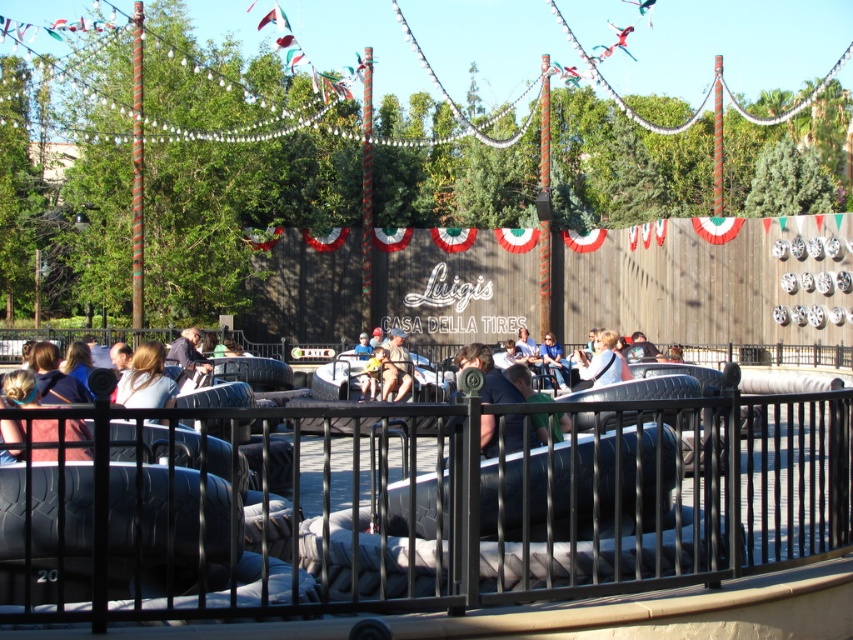
Between point (71, 476) and point (160, 380), which one is positioned in front?

Positioned in front is point (71, 476).

Does black metal fence at center appear under blonde hair at center?

Indeed, black metal fence at center is positioned under blonde hair at center.

This screenshot has width=853, height=640. What do you see at coordinates (425, 509) in the screenshot?
I see `black metal fence at center` at bounding box center [425, 509].

You are a GUI agent. You are given a task and a screenshot of the screen. Output one action in this format:
    pyautogui.click(x=<x>, y=<y>)
    Task: Click on the black metal fence at center
    
    Given the screenshot: What is the action you would take?
    pyautogui.click(x=425, y=509)

Is light blue shirt at center to the right of light blue denim jeans at center from the viewer's perspective?

Correct, you'll find light blue shirt at center to the right of light blue denim jeans at center.

Consider the image. Which is above, light blue shirt at center or light blue denim jeans at center?

Positioned higher is light blue shirt at center.

Is point (584, 374) closer to camera compared to point (543, 355)?

Yes, point (584, 374) is in front of point (543, 355).

The width and height of the screenshot is (853, 640). I want to click on light blue shirt at center, so click(602, 362).

Looking at this image, who is positioned more to the right, black metal fence at center or light blue shirt at center?

Positioned to the right is light blue shirt at center.

Does black metal fence at center have a lesser height compared to light blue shirt at center?

No, black metal fence at center is not shorter than light blue shirt at center.

The image size is (853, 640). What do you see at coordinates (425, 509) in the screenshot? I see `black metal fence at center` at bounding box center [425, 509].

Where is `black metal fence at center`? black metal fence at center is located at coordinates (425, 509).